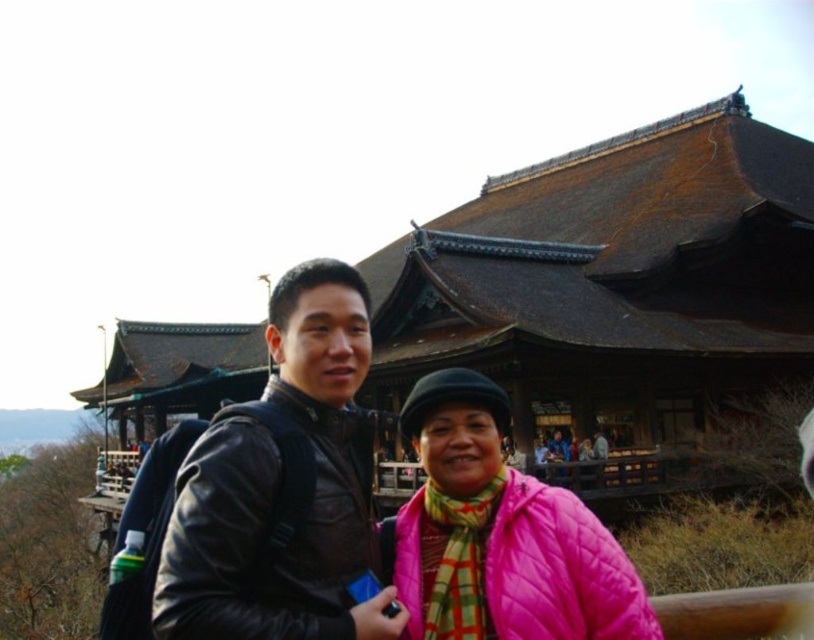
Does leather jacket at center have a greater width compared to pink quilted jacket at center?

In fact, leather jacket at center might be narrower than pink quilted jacket at center.

Can you confirm if leather jacket at center is positioned to the right of pink quilted jacket at center?

In fact, leather jacket at center is to the left of pink quilted jacket at center.

At what (x,y) coordinates should I click in order to perform the action: click on leather jacket at center. Please return your answer as a coordinate pair (x, y). The height and width of the screenshot is (640, 814). Looking at the image, I should click on tap(279, 486).

Between brown wooden palace at center and leather jacket at center, which one appears on the left side from the viewer's perspective?

From the viewer's perspective, brown wooden palace at center appears more on the left side.

Does brown wooden palace at center have a lesser height compared to leather jacket at center?

No.

This screenshot has height=640, width=814. Find the location of `brown wooden palace at center`. brown wooden palace at center is located at coordinates (613, 282).

Locate an element on the screen. The height and width of the screenshot is (640, 814). brown wooden palace at center is located at coordinates (613, 282).

Who is lower down, brown wooden palace at center or pink quilted jacket at center?

pink quilted jacket at center is lower down.

Which is behind, point (624, 397) or point (488, 404)?

Positioned behind is point (624, 397).

Who is more distant from viewer, [447,349] or [479,556]?

Positioned behind is point [447,349].

This screenshot has height=640, width=814. I want to click on brown wooden palace at center, so click(x=613, y=282).